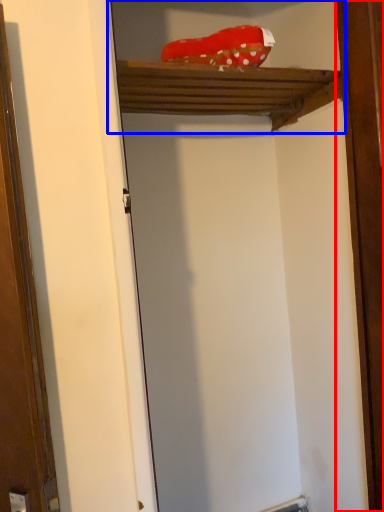
Question: Which object is further to the camera taking this photo, barn door (highlighted by a red box) or cabinet (highlighted by a blue box)?

Choices:
 (A) barn door
 (B) cabinet

Answer: (A)